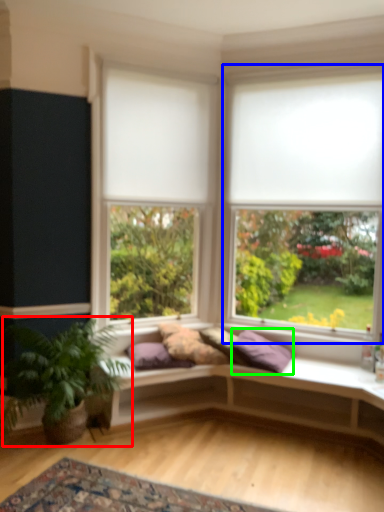
Question: Which object is the closest to the houseplant (highlighted by a red box)? Choose among these: window (highlighted by a blue box) or pillow (highlighted by a green box).

Choices:
 (A) window
 (B) pillow

Answer: (B)